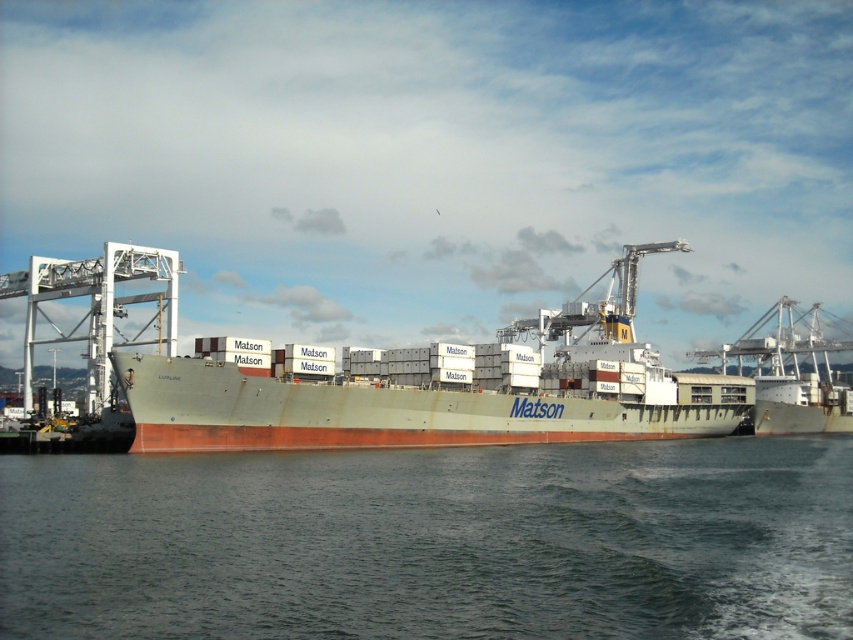
Can you confirm if dark blue water at center is positioned to the right of green matte container ship at center?

Incorrect, dark blue water at center is not on the right side of green matte container ship at center.

Does dark blue water at center have a smaller size compared to green matte container ship at center?

Correct, dark blue water at center occupies less space than green matte container ship at center.

Who is more distant from viewer, (256,497) or (396,432)?

The point (396,432) is more distant.

Where is `dark blue water at center`? dark blue water at center is located at coordinates (433, 541).